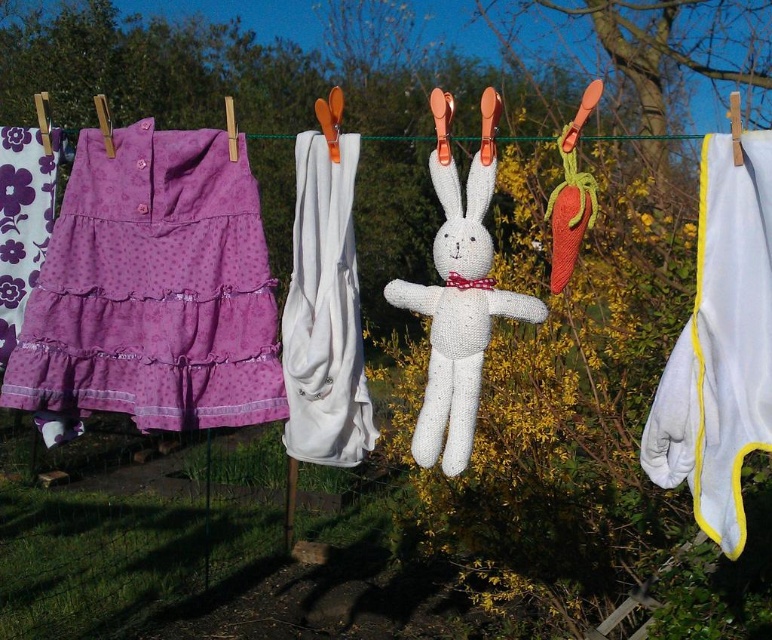
Looking at this image, can you confirm if purple polka dot fabric dress at left is smaller than white fabric at center?

Actually, purple polka dot fabric dress at left might be larger than white fabric at center.

Which of these two, purple polka dot fabric dress at left or white fabric at center, stands taller?

white fabric at center is taller.

Between point (234, 412) and point (351, 444), which one is positioned in front?

Point (351, 444)

The image size is (772, 640). What are the coordinates of `purple polka dot fabric dress at left` in the screenshot? It's located at (151, 291).

Is white fabric at center thinner than purple polka dot fabric at upper left?

Yes, white fabric at center is thinner than purple polka dot fabric at upper left.

Find the location of a particular element. The height and width of the screenshot is (640, 772). white fabric at center is located at coordinates (324, 312).

What do you see at coordinates (324, 312) in the screenshot? I see `white fabric at center` at bounding box center [324, 312].

This screenshot has width=772, height=640. Find the location of `white fabric at center`. white fabric at center is located at coordinates (324, 312).

Between white cotton glove at right and white knitted rabbit at center, which one has less height?

Standing shorter between the two is white knitted rabbit at center.

Does point (740, 460) come farther from viewer compared to point (466, 369)?

No, (740, 460) is in front of (466, 369).

The height and width of the screenshot is (640, 772). What are the coordinates of `white cotton glove at right` in the screenshot? It's located at (720, 342).